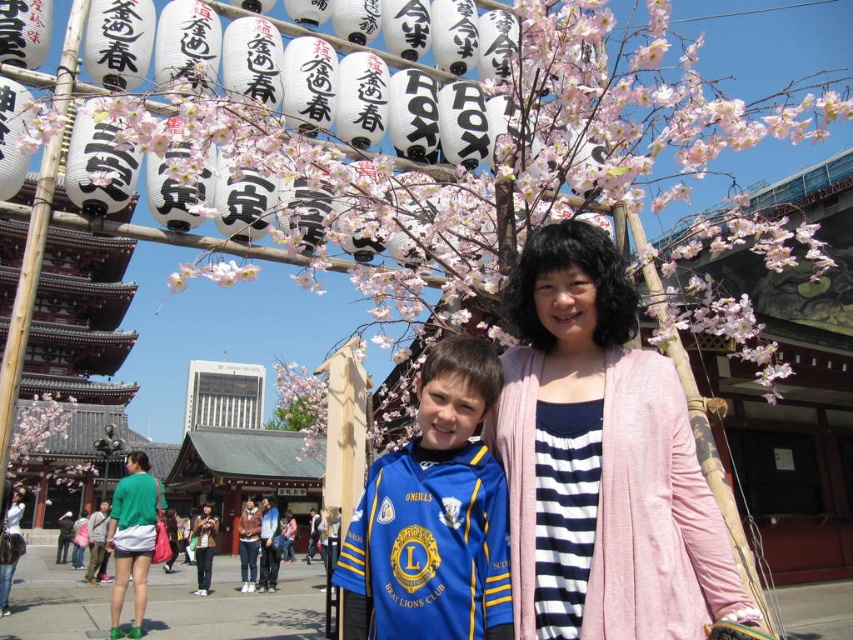
Question: Considering the real-world distances, which object is closest to the pink fabric at center?

Choices:
 (A) green jersey at center
 (B) blue jersey at center

Answer: (B)

Question: Is the position of pink fabric at center less distant than that of blue jersey at center?

Choices:
 (A) yes
 (B) no

Answer: (A)

Question: Can you confirm if pink fabric at center is positioned to the left of blue jersey at center?

Choices:
 (A) no
 (B) yes

Answer: (A)

Question: Which object is positioned farthest from the pink fabric at center?

Choices:
 (A) blue jersey at center
 (B) green jersey at center

Answer: (B)

Question: In this image, where is blue jersey at center located relative to green jersey at center?

Choices:
 (A) above
 (B) below

Answer: (A)

Question: Which of these objects is positioned closest to the green jersey at center?

Choices:
 (A) blue jersey at center
 (B) pink fabric at center

Answer: (A)